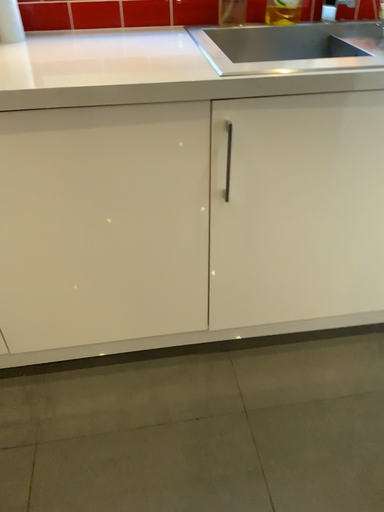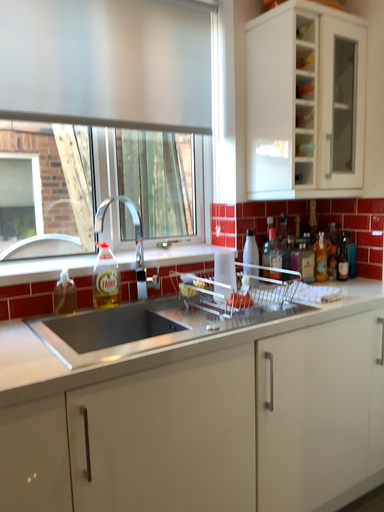
Question: How did the camera likely rotate when shooting the video?

Choices:
 (A) rotated left
 (B) rotated right

Answer: (B)